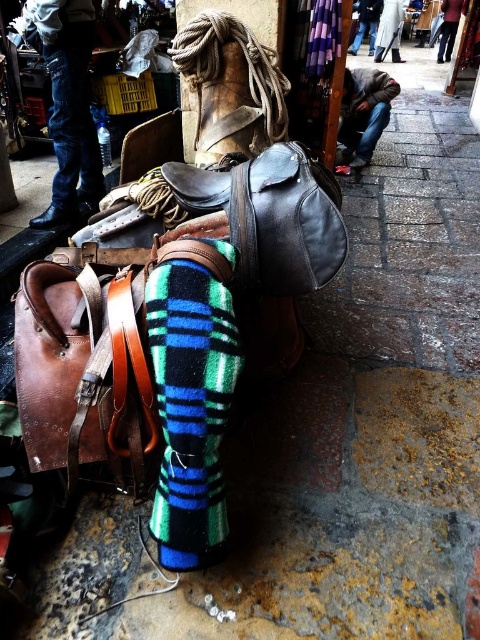
Question: Which object appears closest to the camera in this image?

Choices:
 (A) brown leather shoe at lower center
 (B) black leather shoe at lower left
 (C) green plaid sock at center

Answer: (C)

Question: Is black leather shoe at lower left to the left of brown leather shoe at lower center from the viewer's perspective?

Choices:
 (A) yes
 (B) no

Answer: (A)

Question: Does black leather shoe at lower left have a greater width compared to brown leather shoe at lower center?

Choices:
 (A) yes
 (B) no

Answer: (A)

Question: Which point appears closest to the camera in this image?

Choices:
 (A) (182, 461)
 (B) (62, 209)
 (C) (350, 168)

Answer: (A)

Question: Which object appears farthest from the camera in this image?

Choices:
 (A) black leather shoe at lower left
 (B) brown leather shoe at lower center

Answer: (B)

Question: Does green plaid sock at center come in front of brown leather shoe at lower center?

Choices:
 (A) yes
 (B) no

Answer: (A)